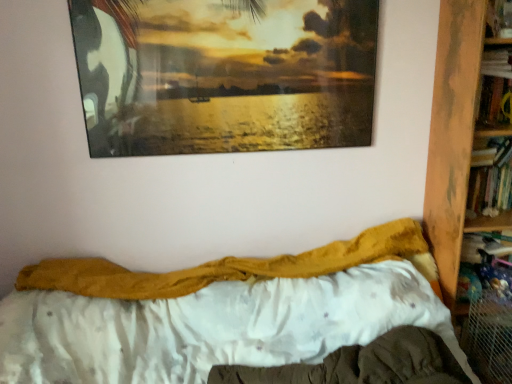
Image resolution: width=512 pixels, height=384 pixels. What do you see at coordinates (362, 364) in the screenshot?
I see `white satin mattress at lower center` at bounding box center [362, 364].

Measure the distance between point (461,170) and camera.

Point (461,170) and camera are 5.30 feet apart from each other.

Locate an element on the screen. The width and height of the screenshot is (512, 384). fuzzy yellow blanket at center is located at coordinates (215, 312).

The height and width of the screenshot is (384, 512). I want to click on white satin mattress at lower center, so click(362, 364).

In the image, is metallic glossy picture frame at upper center positioned in front of or behind mustard yellow fabric at center?

Clearly, metallic glossy picture frame at upper center is in front of mustard yellow fabric at center.

From the image's perspective, which one is positioned higher, metallic glossy picture frame at upper center or mustard yellow fabric at center?

metallic glossy picture frame at upper center.

Which point is more distant from viewer, (97, 77) or (31, 281)?

Point (31, 281)

Is fuzzy yellow blanket at center taller than mustard yellow fabric at center?

Yes.

Which object is positioned more to the left, fuzzy yellow blanket at center or mustard yellow fabric at center?

From the viewer's perspective, fuzzy yellow blanket at center appears more on the left side.

Can we say fuzzy yellow blanket at center lies outside mustard yellow fabric at center?

fuzzy yellow blanket at center lies outside mustard yellow fabric at center's area.

Does white satin mattress at lower center have a lesser width compared to fuzzy yellow blanket at center?

Indeed, white satin mattress at lower center has a lesser width compared to fuzzy yellow blanket at center.

Do you think white satin mattress at lower center is within fuzzy yellow blanket at center, or outside of it?

The correct answer is: inside.

Is white satin mattress at lower center at the right side of fuzzy yellow blanket at center?

Indeed, white satin mattress at lower center is positioned on the right side of fuzzy yellow blanket at center.

Is white satin mattress at lower center taller or shorter than fuzzy yellow blanket at center?

Considering their sizes, white satin mattress at lower center has less height than fuzzy yellow blanket at center.

Would you say metallic glossy picture frame at upper center is a long distance from white satin mattress at lower center?

metallic glossy picture frame at upper center is far away from white satin mattress at lower center.

How different are the orientations of metallic glossy picture frame at upper center and white satin mattress at lower center in degrees?

1.09 degrees.

Does metallic glossy picture frame at upper center lie behind white satin mattress at lower center?

Yes, metallic glossy picture frame at upper center is further from the camera.

What are the coordinates of `picture frame behind the white satin mattress at lower center` in the screenshot? It's located at (225, 74).

Is metallic glossy picture frame at upper center wider or thinner than fuzzy yellow blanket at center?

In the image, metallic glossy picture frame at upper center appears to be more narrow than fuzzy yellow blanket at center.

Is fuzzy yellow blanket at center a part of metallic glossy picture frame at upper center?

That's incorrect, fuzzy yellow blanket at center is not inside metallic glossy picture frame at upper center.

How different are the orientations of metallic glossy picture frame at upper center and fuzzy yellow blanket at center in degrees?

metallic glossy picture frame at upper center and fuzzy yellow blanket at center are facing 1.09 degrees away from each other.

Where is `picture frame above the fuzzy yellow blanket at center (from the image's perspective)`? The width and height of the screenshot is (512, 384). picture frame above the fuzzy yellow blanket at center (from the image's perspective) is located at coordinates (225, 74).

Considering the positions of points (449, 189) and (412, 377), is point (449, 189) farther from camera compared to point (412, 377)?

Yes, it is behind point (412, 377).

Does wooden bookcase at right have a larger size compared to white satin mattress at lower center?

Yes.

Could you tell me if wooden bookcase at right is turned towards white satin mattress at lower center?

No, wooden bookcase at right is not turned towards white satin mattress at lower center.

Based on the photo, is mustard yellow fabric at center next to fuzzy yellow blanket at center and touching it?

They are not placed beside each other.

From the image's perspective, is mustard yellow fabric at center above fuzzy yellow blanket at center?

Yes.

Considering their positions, is mustard yellow fabric at center located in front of or behind fuzzy yellow blanket at center?

In the image, mustard yellow fabric at center appears behind fuzzy yellow blanket at center.

Find the location of a particular element. Image resolution: width=512 pixels, height=384 pixels. picture frame in front of the mustard yellow fabric at center is located at coordinates (225, 74).

The height and width of the screenshot is (384, 512). What are the coordinates of `blanket on the right of fuzzy yellow blanket at center` in the screenshot? It's located at (223, 267).

Consider the image. Which object lies further to the anchor point white satin mattress at lower center, fuzzy yellow blanket at center or mustard yellow fabric at center?

mustard yellow fabric at center.

From the image, which object appears to be nearer to metallic glossy picture frame at upper center, fuzzy yellow blanket at center or wooden bookcase at right?

Among the two, wooden bookcase at right is located nearer to metallic glossy picture frame at upper center.

Looking at the image, which one is located further to mustard yellow fabric at center, metallic glossy picture frame at upper center or fuzzy yellow blanket at center?

The object further to mustard yellow fabric at center is metallic glossy picture frame at upper center.

Estimate the real-world distances between objects in this image. Which object is further from white satin mattress at lower center, wooden bookcase at right or fuzzy yellow blanket at center?

wooden bookcase at right is further to white satin mattress at lower center.

Considering their positions, is fuzzy yellow blanket at center positioned closer to metallic glossy picture frame at upper center than mustard yellow fabric at center?

mustard yellow fabric at center is positioned closer to the anchor metallic glossy picture frame at upper center.

Considering their positions, is wooden bookcase at right positioned closer to fuzzy yellow blanket at center than white satin mattress at lower center?

Among the two, white satin mattress at lower center is located nearer to fuzzy yellow blanket at center.

Which object lies further to the anchor point white satin mattress at lower center, mustard yellow fabric at center or wooden bookcase at right?

wooden bookcase at right is further to white satin mattress at lower center.

Looking at the image, which one is located closer to white satin mattress at lower center, metallic glossy picture frame at upper center or mustard yellow fabric at center?

The object closer to white satin mattress at lower center is mustard yellow fabric at center.

Where is `mattress situated between fuzzy yellow blanket at center and wooden bookcase at right from left to right`? mattress situated between fuzzy yellow blanket at center and wooden bookcase at right from left to right is located at coordinates (362, 364).

The image size is (512, 384). I want to click on blanket between metallic glossy picture frame at upper center and fuzzy yellow blanket at center vertically, so click(x=223, y=267).

Find the location of a particular element. The image size is (512, 384). picture frame located between fuzzy yellow blanket at center and wooden bookcase at right in the left-right direction is located at coordinates (225, 74).

The height and width of the screenshot is (384, 512). What are the coordinates of `mattress located between fuzzy yellow blanket at center and mustard yellow fabric at center in the depth direction` in the screenshot? It's located at click(x=362, y=364).